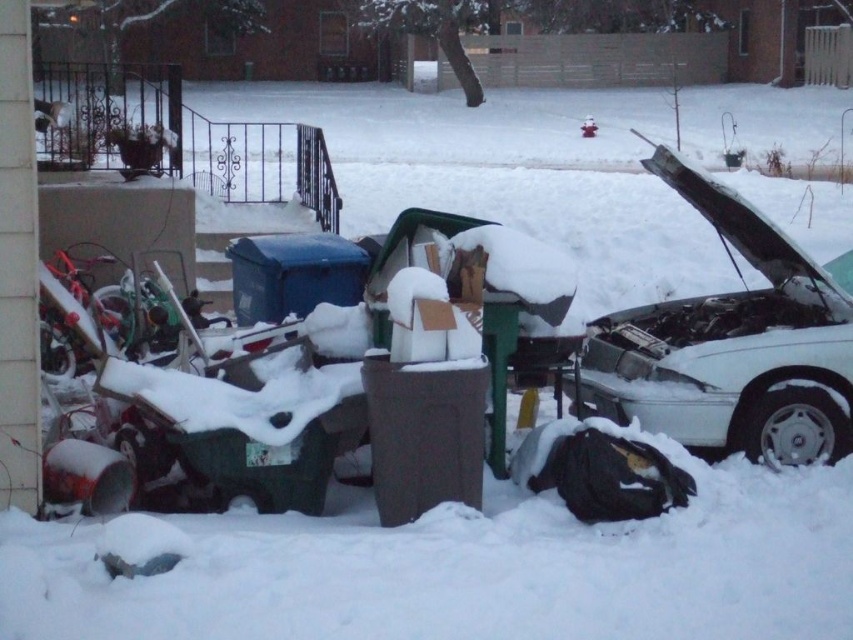
Can you confirm if white matte car at right is positioned to the left of brown matte trash can at center?

In fact, white matte car at right is to the right of brown matte trash can at center.

Does white matte car at right have a lesser height compared to brown matte trash can at center?

No.

Does point (799, 381) lie behind point (425, 445)?

Yes, point (799, 381) is behind point (425, 445).

This screenshot has height=640, width=853. Identify the location of white matte car at right. (732, 346).

Describe the element at coordinates (732, 346) in the screenshot. I see `white matte car at right` at that location.

Between white matte car at right and blue plastic bin at center, which one is positioned lower?

Positioned lower is white matte car at right.

Is point (689, 320) behind point (316, 269)?

Yes, it is.

This screenshot has height=640, width=853. What are the coordinates of `white matte car at right` in the screenshot? It's located at (732, 346).

Which is below, brown matte trash can at center or blue plastic bin at center?

brown matte trash can at center is lower down.

Does brown matte trash can at center have a greater height compared to blue plastic bin at center?

Correct, brown matte trash can at center is much taller as blue plastic bin at center.

Describe the element at coordinates (424, 433) in the screenshot. I see `brown matte trash can at center` at that location.

The width and height of the screenshot is (853, 640). I want to click on brown matte trash can at center, so click(x=424, y=433).